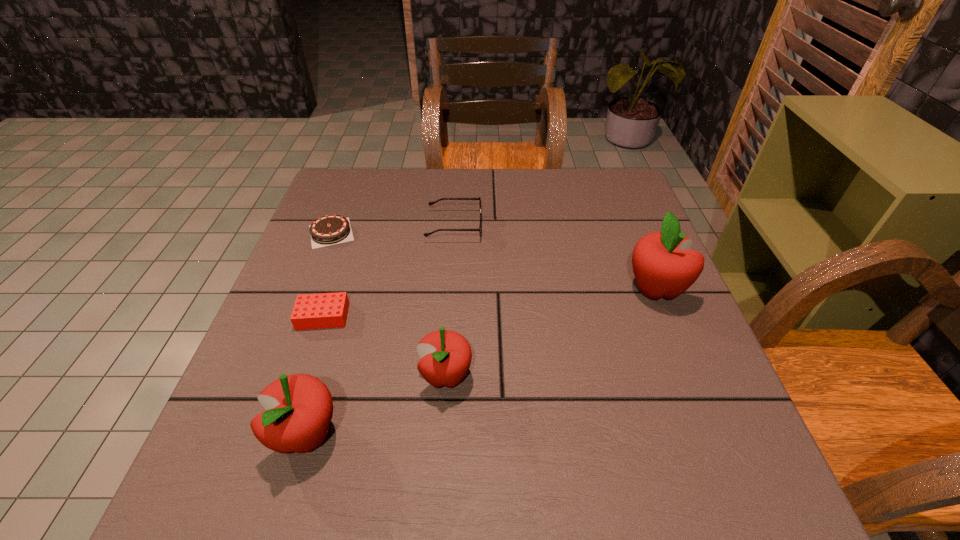
Where is `free spot between the third tallest object and the shortest object`? Image resolution: width=960 pixels, height=540 pixels. free spot between the third tallest object and the shortest object is located at coordinates (389, 305).

Locate an element on the screen. This screenshot has width=960, height=540. vacant area that lies between the Lego and the sunglasses is located at coordinates tap(389, 271).

Identify the location of vacant area that lies between the second tallest object and the farthest apple. The height and width of the screenshot is (540, 960). (481, 362).

The width and height of the screenshot is (960, 540). Identify the location of empty space between the rightmost apple and the Lego. (490, 302).

Locate an element on the screen. free spot between the rightmost object and the Lego is located at coordinates (490, 302).

Where is `free space between the sunglasses and the second nearest apple`? The image size is (960, 540). free space between the sunglasses and the second nearest apple is located at coordinates (450, 301).

I want to click on vacant space that's between the nearest apple and the farthest apple, so click(x=481, y=362).

Locate which object is the second closest to the Lego. Please provide its 2D coordinates. Your answer should be formatted as a tuple, i.e. [(x, y)], where the tuple contains the x and y coordinates of a point satisfying the conditions above.

[(446, 355)]

Identify which object is the second closest to the nearest apple. Please provide its 2D coordinates. Your answer should be formatted as a tuple, i.e. [(x, y)], where the tuple contains the x and y coordinates of a point satisfying the conditions above.

[(327, 310)]

Identify which apple is the nearest to the nearest object. Please provide its 2D coordinates. Your answer should be formatted as a tuple, i.e. [(x, y)], where the tuple contains the x and y coordinates of a point satisfying the conditions above.

[(446, 355)]